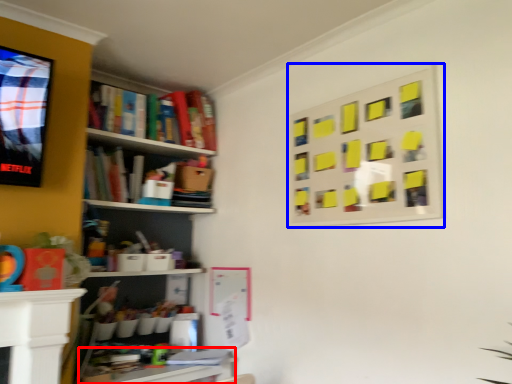
Question: Which point is further to the camera, table (highlighted by a red box) or bulletin board (highlighted by a blue box)?

Choices:
 (A) table
 (B) bulletin board

Answer: (A)